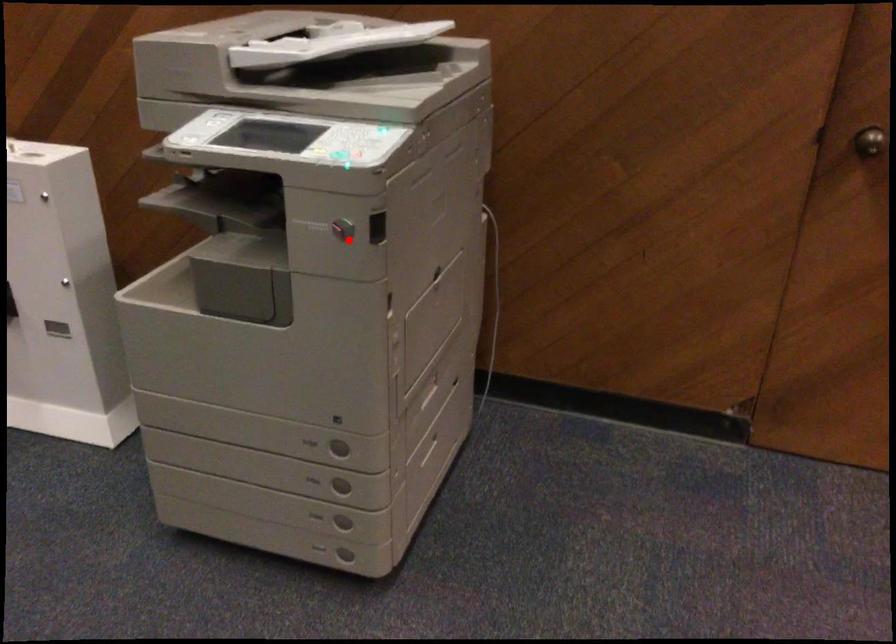
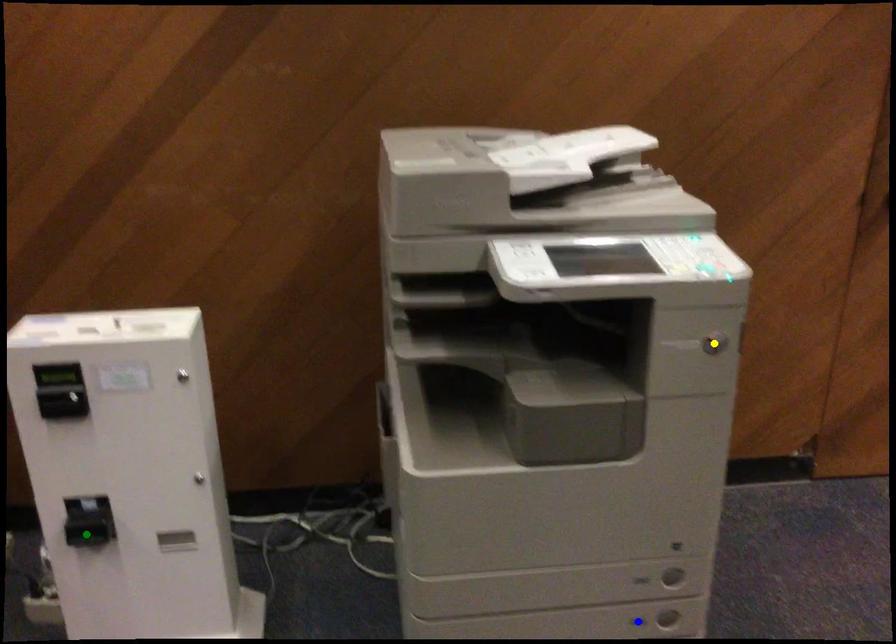
Question: I am providing you with two images of the same scene from different viewpoints. A red point is marked on the first image. You are given multiple points on the second image. Can you choose the point in image 2 that corresponds to the point in image 1?

Choices:
 (A) yellow point
 (B) blue point
 (C) green point

Answer: (A)